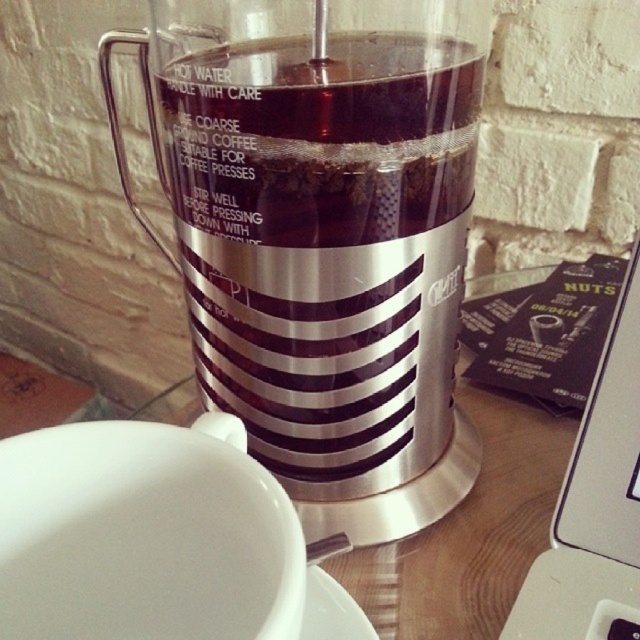
Does satin silver blender at center have a lesser width compared to black plastic laptop at lower right?

In fact, satin silver blender at center might be wider than black plastic laptop at lower right.

Does satin silver blender at center lie in front of black plastic laptop at lower right?

That is True.

Which is in front, point (339, 170) or point (612, 529)?

Point (339, 170) is more forward.

You are a GUI agent. You are given a task and a screenshot of the screen. Output one action in this format:
    pyautogui.click(x=<x>, y=<y>)
    Task: Click on the satin silver blender at center
    The width and height of the screenshot is (640, 640).
    Given the screenshot: What is the action you would take?
    pyautogui.click(x=323, y=236)

Which is above, black plastic laptop at lower right or white ceramic saucer at lower center?

black plastic laptop at lower right is above.

Is point (570, 529) positioned after point (353, 627)?

That is True.

The width and height of the screenshot is (640, 640). Find the location of `black plastic laptop at lower right`. black plastic laptop at lower right is located at coordinates (595, 506).

Does point (400, 161) lie behind point (369, 632)?

No.

Is satin silver blender at center bigger than white ceramic saucer at lower center?

Yes, satin silver blender at center is bigger than white ceramic saucer at lower center.

Measure the distance between satin silver blender at center and camera.

satin silver blender at center is 27.07 centimeters away from camera.

This screenshot has width=640, height=640. What are the coordinates of `satin silver blender at center` in the screenshot? It's located at (323, 236).